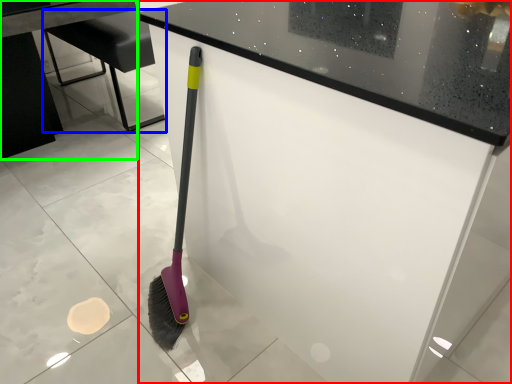
Question: Which object is positioned closest to counter (highlighted by a red box)? Select from furniture (highlighted by a blue box) and table (highlighted by a green box).

Choices:
 (A) furniture
 (B) table

Answer: (A)